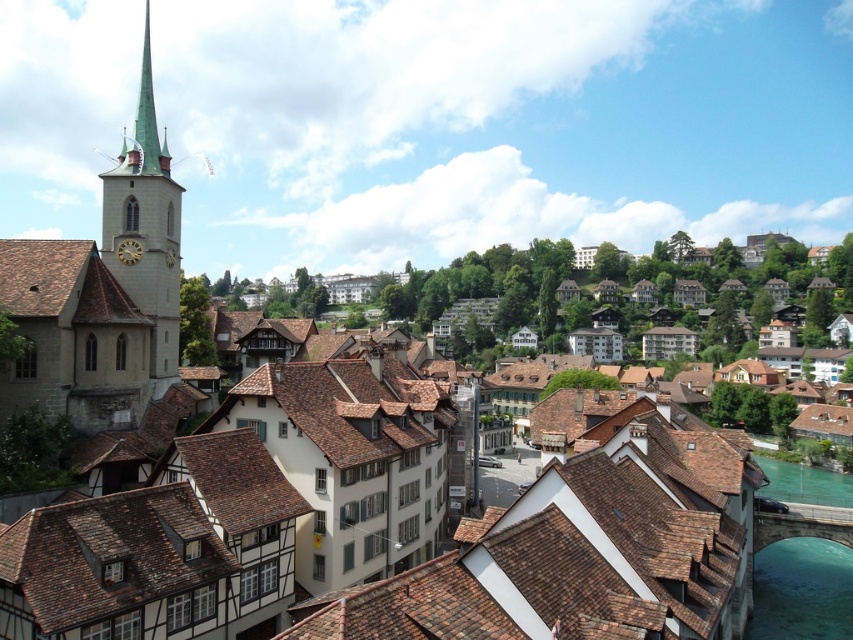
Question: Which object is farther from the camera taking this photo?

Choices:
 (A) green spire at left
 (B) green copper spire at upper left
 (C) brown tile roof at center
 (D) clear blue water at lower right

Answer: (B)

Question: Is green spire at left to the right of clear blue water at lower right from the viewer's perspective?

Choices:
 (A) no
 (B) yes

Answer: (A)

Question: Which point is closer to the camera taking this photo?

Choices:
 (A) (793, 548)
 (B) (140, 172)
 (C) (140, 198)

Answer: (C)

Question: Among these points, which one is nearest to the camera?

Choices:
 (A) (761, 625)
 (B) (149, 310)
 (C) (161, 168)
 (D) (631, 488)

Answer: (D)

Question: Is clear blue water at lower right smaller than green copper spire at upper left?

Choices:
 (A) yes
 (B) no

Answer: (A)

Question: Can you confirm if clear blue water at lower right is positioned above green copper spire at upper left?

Choices:
 (A) yes
 (B) no

Answer: (B)